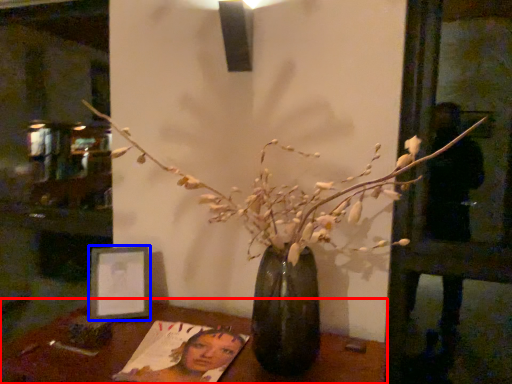
Question: Which object is closer to the camera taking this photo, table (highlighted by a red box) or picture frame (highlighted by a blue box)?

Choices:
 (A) table
 (B) picture frame

Answer: (A)